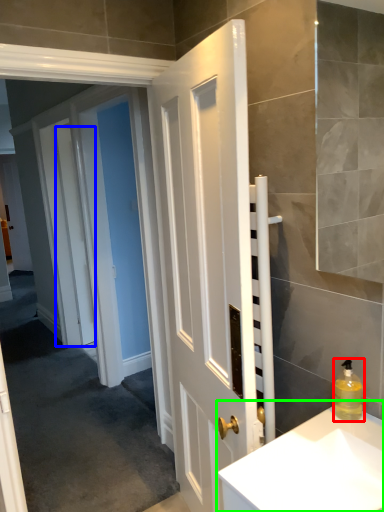
Question: Estimate the real-world distances between objects in this image. Which object is closer to soap dispenser (highlighted by a red box), door (highlighted by a blue box) or sink (highlighted by a green box)?

Choices:
 (A) door
 (B) sink

Answer: (B)